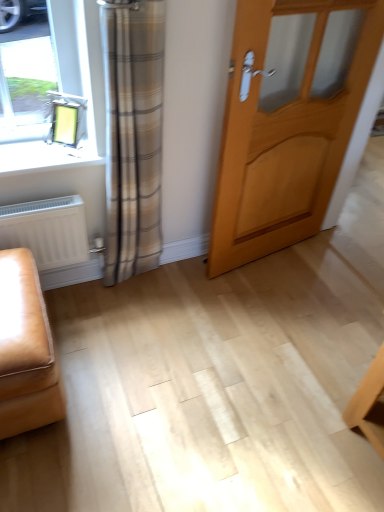
Question: Looking at the image, does leather ottoman at lower left seem bigger or smaller compared to light wood door at center?

Choices:
 (A) big
 (B) small

Answer: (B)

Question: Is leather ottoman at lower left in front of or behind light wood door at center in the image?

Choices:
 (A) front
 (B) behind

Answer: (A)

Question: Which object is positioned farthest from the white matte radiator at lower left?

Choices:
 (A) leather ottoman at lower left
 (B) light wood door at center

Answer: (B)

Question: Considering the real-world distances, which object is closest to the white matte radiator at lower left?

Choices:
 (A) light wood door at center
 (B) leather ottoman at lower left

Answer: (B)